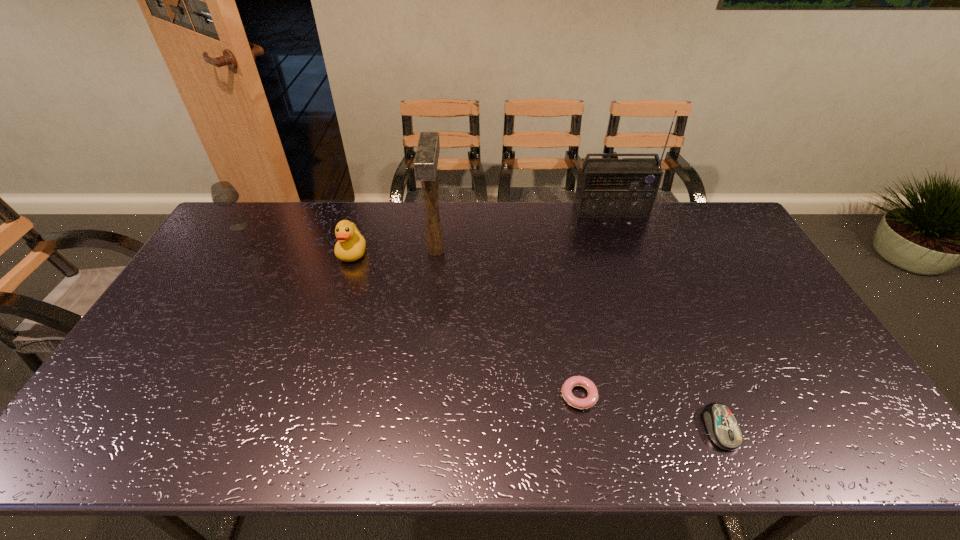
Find the location of a particular element. object that is at the far left corner is located at coordinates (223, 194).

The image size is (960, 540). In order to click on vacant space at the far edge of the desktop in this screenshot , I will do `click(468, 234)`.

In the image, there is a desktop. Where is `vacant space at the left edge`? vacant space at the left edge is located at coordinates (212, 259).

You are a GUI agent. You are given a task and a screenshot of the screen. Output one action in this format:
    pyautogui.click(x=<x>, y=<y>)
    Task: Click on the free region at the near left corner
    
    Given the screenshot: What is the action you would take?
    pyautogui.click(x=109, y=420)

Where is `vacant point at the near right corner`? The image size is (960, 540). vacant point at the near right corner is located at coordinates 806,423.

At what (x,y) coordinates should I click in order to perform the action: click on free space between the duck and the computer mouse. Please return your answer as a coordinate pair (x, y). This screenshot has height=540, width=960. Looking at the image, I should click on (537, 341).

Where is `free space that is in between the fourth shortest object and the fifth object from right to left`? free space that is in between the fourth shortest object and the fifth object from right to left is located at coordinates (296, 239).

This screenshot has width=960, height=540. Find the location of `free space between the duck and the doughnut`. free space between the duck and the doughnut is located at coordinates point(466,324).

Identify the location of vacant space that is in between the fifth object from right to left and the fifth nearest object. pos(296,239).

The height and width of the screenshot is (540, 960). Identify the location of free space between the second shortest object and the second object from left to right. (537, 341).